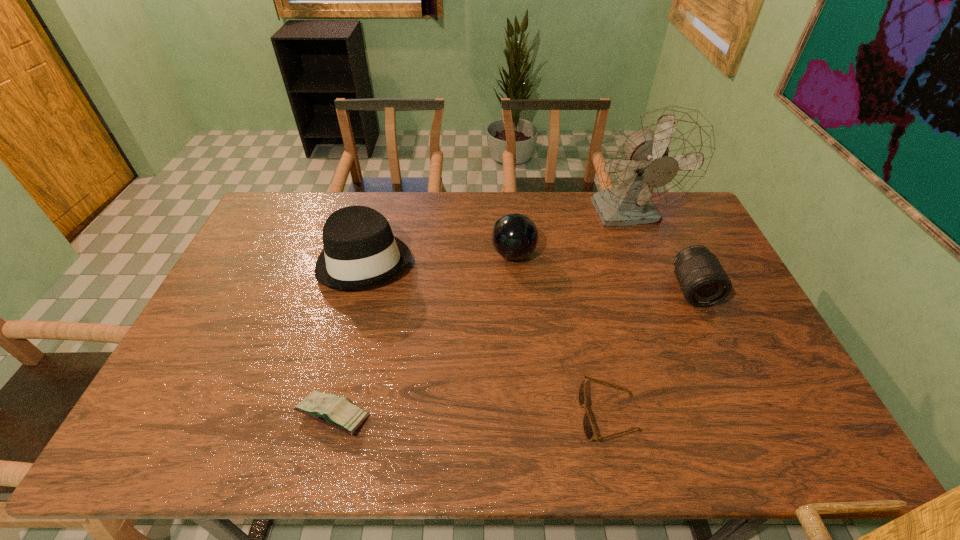
In order to click on vacant region located 0.090m on the side of the bowling ball with the finger holes in this screenshot , I will do `click(464, 254)`.

At what (x,y) coordinates should I click in order to perform the action: click on free region located on the side of the bowling ball with the finger holes. Please return your answer as a coordinate pair (x, y). Looking at the image, I should click on (373, 254).

Find the location of a particular element. free space located 0.160m on the surface of the telephoto lens is located at coordinates (723, 354).

Identify the location of vacant area situated 0.090m on the frames of the sunglasses. (543, 415).

Locate an element on the screen. The height and width of the screenshot is (540, 960). free space located 0.090m on the frames of the sunglasses is located at coordinates (543, 415).

Identify the location of free space located 0.290m on the frames of the sunglasses. The height and width of the screenshot is (540, 960). (460, 415).

This screenshot has width=960, height=540. In order to click on vacant space situated on the right of the diary in this screenshot , I will do `click(508, 415)`.

Locate an element on the screen. The width and height of the screenshot is (960, 540). fan located at the far edge is located at coordinates (658, 158).

The image size is (960, 540). What are the coordinates of `fedora located at the far edge` in the screenshot? It's located at (360, 250).

Image resolution: width=960 pixels, height=540 pixels. In order to click on sunglasses at the near edge in this screenshot , I will do `click(588, 428)`.